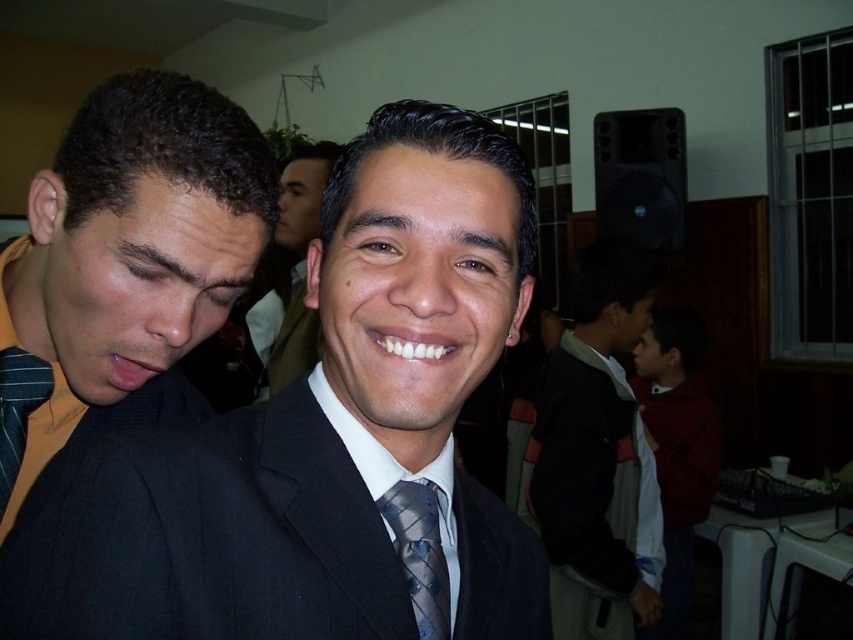
You are at the point labeled point (393, 493) and want to move to the exit located at point (305, 177). Can you walk directly towards the exit without any obstacles blocking your path?

Point (305, 177) is behind point (393, 493), so you cannot walk directly to the exit as the path is blocked by the latter point.

You are a photographer setting up for a group photo. You need to ensure that the matte black suit at center and the blue textured tie at center are both visible in the frame. Given their sizes, which one might require you to adjust the camera angle to include it properly?

The matte black suit at center has a greater height compared to the blue textured tie at center, so you might need to adjust the camera angle to ensure the taller matte black suit at center is fully visible in the frame.